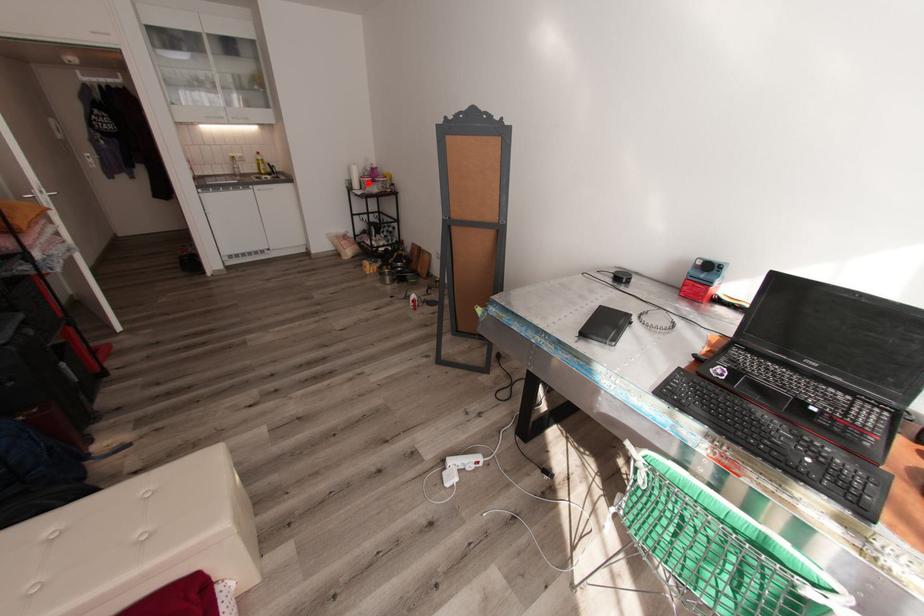
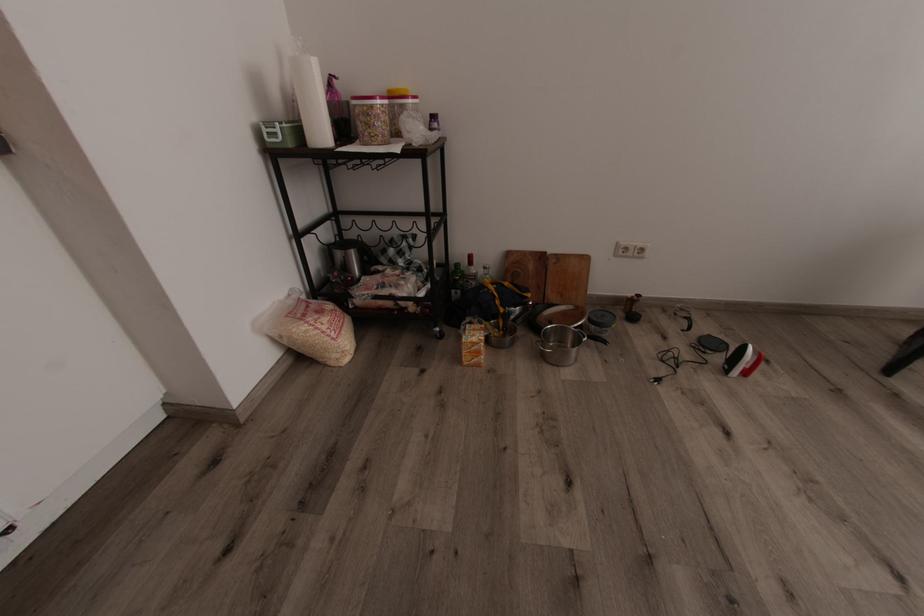
Question: I am providing you with two images of the same scene from different viewpoints. A red point is shown in image1. For the corresponding object point in image2, is it positioned nearer or farther from the camera?

Choices:
 (A) Nearer
 (B) Farther

Answer: (B)